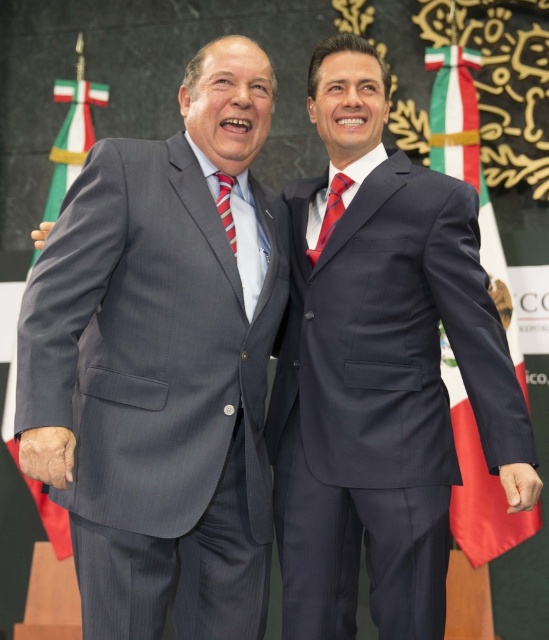
Consider the image. You are a photographer at a formal event in Mexico. You need to capture a photo where the red fabric flag at right and the silky red tie at center are both visible. Based on their positions, which object is lower in the frame?

The red fabric flag at right is below the silky red tie at center, so in the frame, the red fabric flag at right is lower than the silky red tie at center.

What is the location of the point with coordinates (x=163, y=364) in the image?

The point with coordinates (x=163, y=364) is located on the gray pinstripe suit at left.

You are standing at the camera position and want to throw a ball to the point marked as point (x=462, y=125). Can you estimate how far you need to throw the ball to reach that point?

The distance between the camera and point (x=462, y=125) is 32.86 meters, so you need to throw the ball approximately 32.86 meters to reach that point.